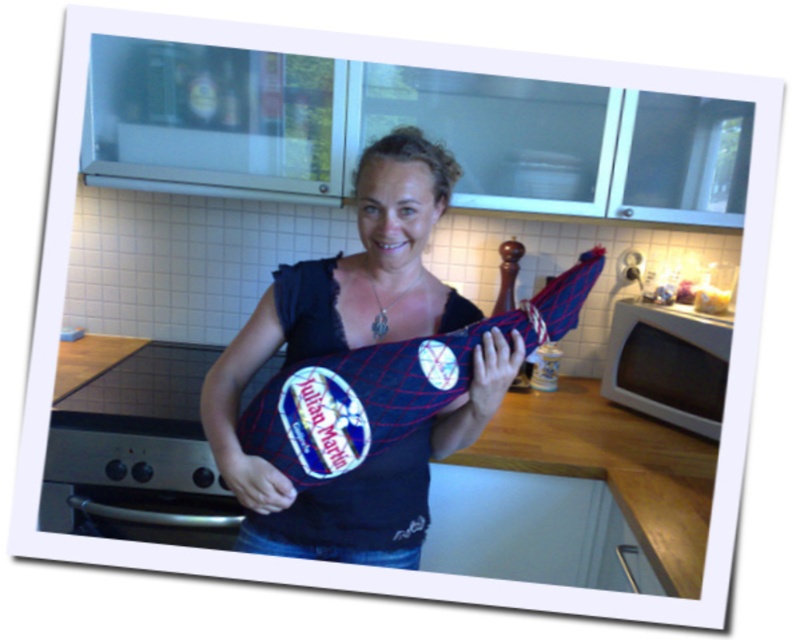
Question: Which object appears farthest from the camera in this image?

Choices:
 (A) white matte microwave at lower right
 (B) matte black shirt at center

Answer: (A)

Question: Which object appears closest to the camera in this image?

Choices:
 (A) matte black shirt at center
 (B) white matte microwave at lower right

Answer: (A)

Question: Where is matte black shirt at center located in relation to white matte microwave at lower right in the image?

Choices:
 (A) below
 (B) above

Answer: (B)

Question: In this image, where is matte black shirt at center located relative to white matte microwave at lower right?

Choices:
 (A) left
 (B) right

Answer: (A)

Question: Considering the relative positions of matte black shirt at center and white matte microwave at lower right in the image provided, where is matte black shirt at center located with respect to white matte microwave at lower right?

Choices:
 (A) below
 (B) above

Answer: (B)